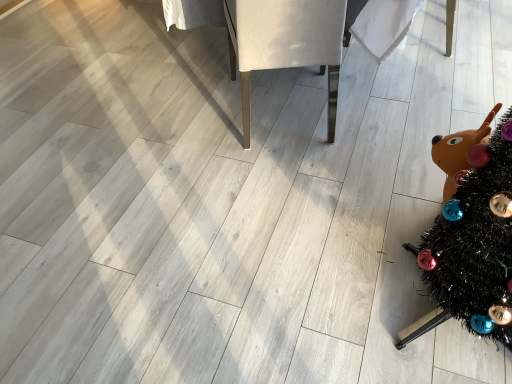
Question: From a real-world perspective, relative to black tinsel christmas tree at lower right, is white fabric chair at center vertically above or below?

Choices:
 (A) below
 (B) above

Answer: (A)

Question: Is white fabric chair at center wider or thinner than black tinsel christmas tree at lower right?

Choices:
 (A) thin
 (B) wide

Answer: (B)

Question: Is white fabric chair at center to the left or to the right of black tinsel christmas tree at lower right in the image?

Choices:
 (A) left
 (B) right

Answer: (A)

Question: In the image, is black tinsel christmas tree at lower right positioned in front of or behind white fabric chair at center?

Choices:
 (A) behind
 (B) front

Answer: (B)

Question: Considering the relative positions of black tinsel christmas tree at lower right and white fabric chair at center in the image provided, is black tinsel christmas tree at lower right to the left or to the right of white fabric chair at center?

Choices:
 (A) right
 (B) left

Answer: (A)

Question: Is black tinsel christmas tree at lower right inside the boundaries of white fabric chair at center, or outside?

Choices:
 (A) outside
 (B) inside

Answer: (A)

Question: Looking at the image, does black tinsel christmas tree at lower right seem bigger or smaller compared to white fabric chair at center?

Choices:
 (A) big
 (B) small

Answer: (B)